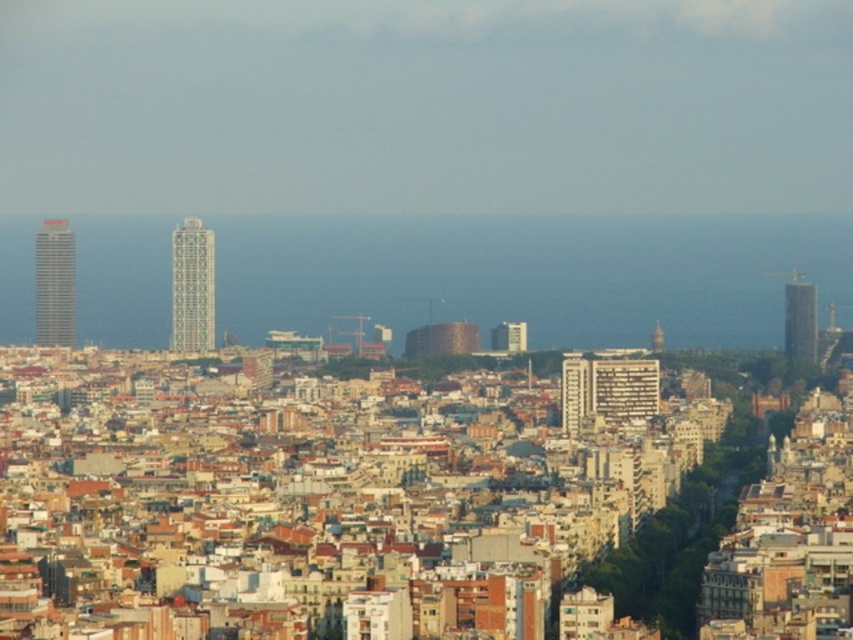
You are an urban planner analyzing the cityscape. From your vantage point, which structure is positioned lower in the scene, the metallic glass tower at center or the matte glass skyscraper at left?

The metallic glass tower at center is positioned lower than the matte glass skyscraper at left in the scene.

You are an urban planner analyzing the cityscape. You need to determine which building has a greater floor area. Based on the view, which one is larger between the metallic glass tower at center and the matte glass skyscraper at left?

The metallic glass tower at center is larger in size than the matte glass skyscraper at left, so it has a greater floor area.